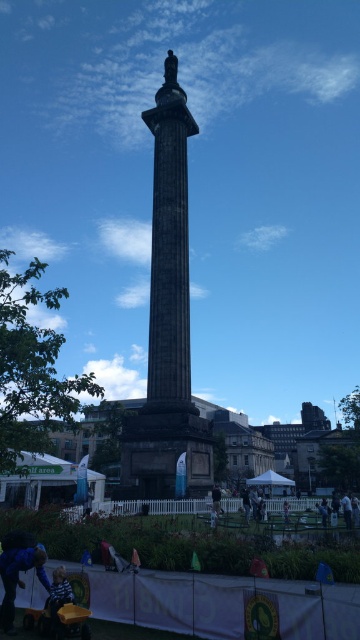
Does blue denim jacket at lower left appear on the left side of yellow plastic baby carriage at lower left?

Yes, blue denim jacket at lower left is to the left of yellow plastic baby carriage at lower left.

In order to click on blue denim jacket at lower left in this screenshot , I will do `click(19, 579)`.

This screenshot has width=360, height=640. What do you see at coordinates (19, 579) in the screenshot?
I see `blue denim jacket at lower left` at bounding box center [19, 579].

At what (x,y) coordinates should I click in order to perform the action: click on blue denim jacket at lower left. Please return your answer as a coordinate pair (x, y). Looking at the image, I should click on (19, 579).

Which is more to the left, yellow plastic baby carriage at lower left or dark blue fabric at center?

yellow plastic baby carriage at lower left

Is yellow plastic baby carriage at lower left above dark blue fabric at center?

No.

This screenshot has height=640, width=360. What are the coordinates of `yellow plastic baby carriage at lower left` in the screenshot? It's located at (59, 620).

Between light blue denim jacket at lower left and dark blue fabric at center, which one appears on the left side from the viewer's perspective?

light blue denim jacket at lower left

Is light blue denim jacket at lower left in front of dark blue fabric at center?

Yes, it is in front of dark blue fabric at center.

Is point (56, 609) positioned behind point (213, 492)?

No, it is not.

Identify the location of light blue denim jacket at lower left. The image size is (360, 640). (57, 595).